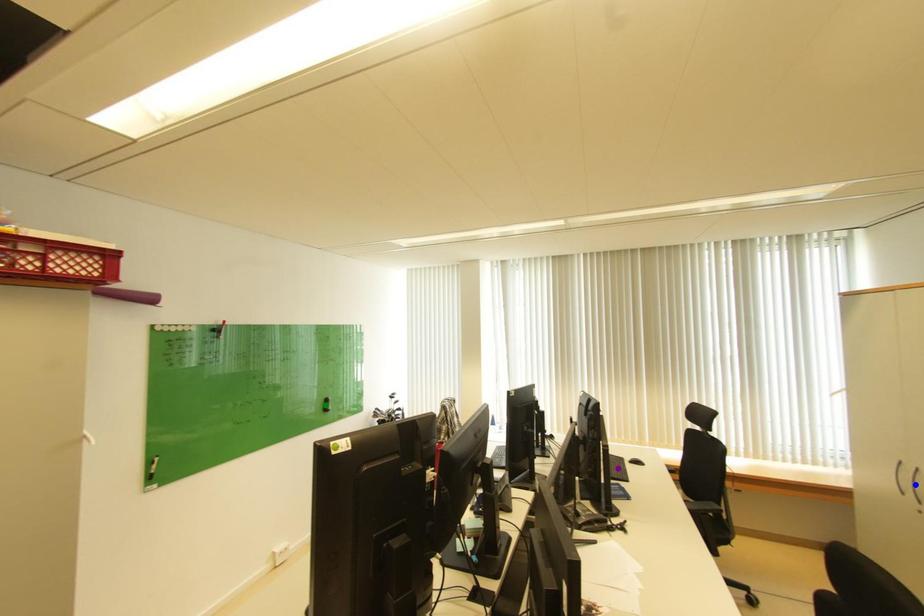
Order these from nearest to farthest:
A) purple point
B) blue point
C) green point

green point, purple point, blue point